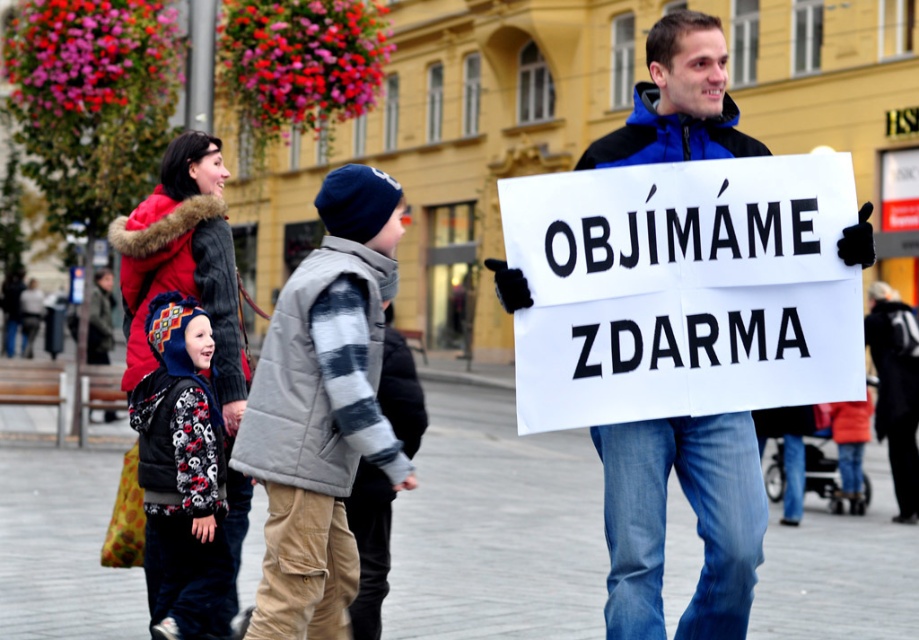
Question: Does white paper sign at center have a lesser width compared to dark blue knit hat at upper left?

Choices:
 (A) yes
 (B) no

Answer: (B)

Question: Which point is closer to the camera?

Choices:
 (A) printed fleece jacket at center
 (B) white paper sign at center
 (C) gray quilted vest at center

Answer: (B)

Question: Can you confirm if blue fleece jacket at center is positioned to the right of dark blue knit hat at upper left?

Choices:
 (A) yes
 (B) no

Answer: (B)

Question: Among these points, which one is farthest from the camera?

Choices:
 (A) (916, 468)
 (B) (775, 368)

Answer: (A)

Question: Does white paper sign at center have a lesser width compared to dark blue knit hat at upper left?

Choices:
 (A) yes
 (B) no

Answer: (B)

Question: Which object is closer to the camera taking this photo?

Choices:
 (A) gray quilted vest at center
 (B) white paper sign at center

Answer: (B)